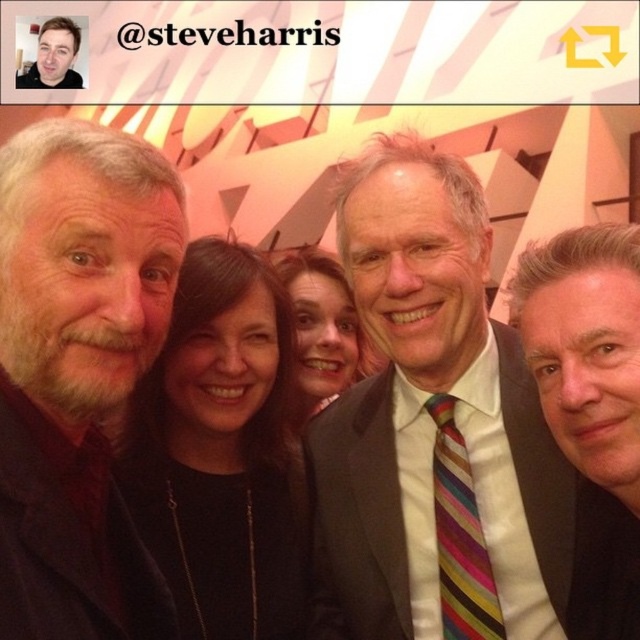
Between smooth black suit at center and matte black jacket at upper left, which one has more height?

Standing taller between the two is matte black jacket at upper left.

Between smooth black suit at center and matte black jacket at upper left, which one has less height?

With less height is smooth black suit at center.

Between point (616, 422) and point (19, 86), which one is positioned behind?

Point (19, 86)

Find the location of `smooth black suit at center`. smooth black suit at center is located at coordinates (589, 404).

Can you confirm if striped tie at center is positioned to the right of gray beard at left?

Indeed, striped tie at center is positioned on the right side of gray beard at left.

In the scene shown: Does striped tie at center have a larger size compared to gray beard at left?

Yes.

What do you see at coordinates (435, 422) in the screenshot? I see `striped tie at center` at bounding box center [435, 422].

The width and height of the screenshot is (640, 640). I want to click on striped tie at center, so click(435, 422).

Which is above, black fabric at center or smooth black suit at center?

smooth black suit at center is higher up.

This screenshot has width=640, height=640. Describe the element at coordinates (221, 452) in the screenshot. I see `black fabric at center` at that location.

This screenshot has width=640, height=640. In order to click on black fabric at center in this screenshot , I will do `click(221, 452)`.